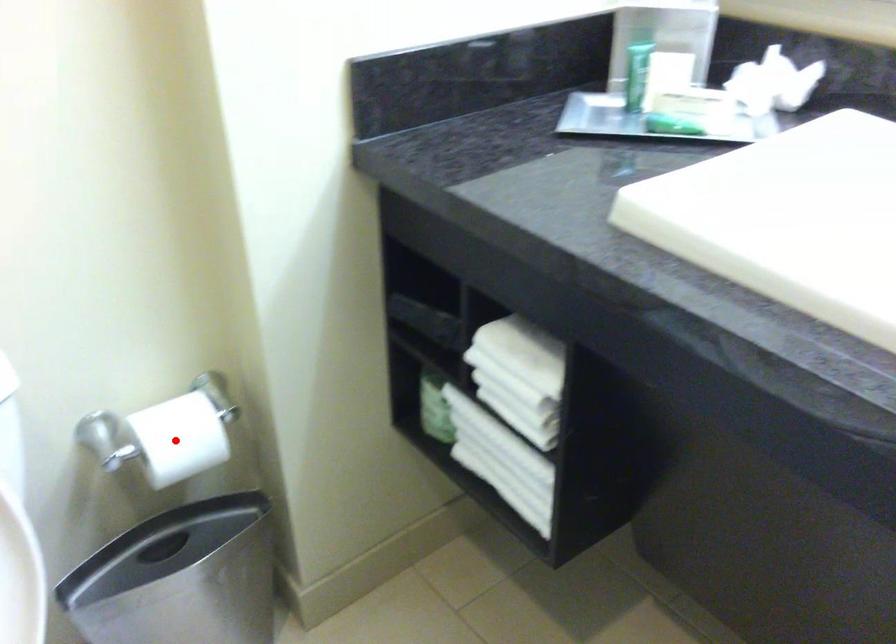
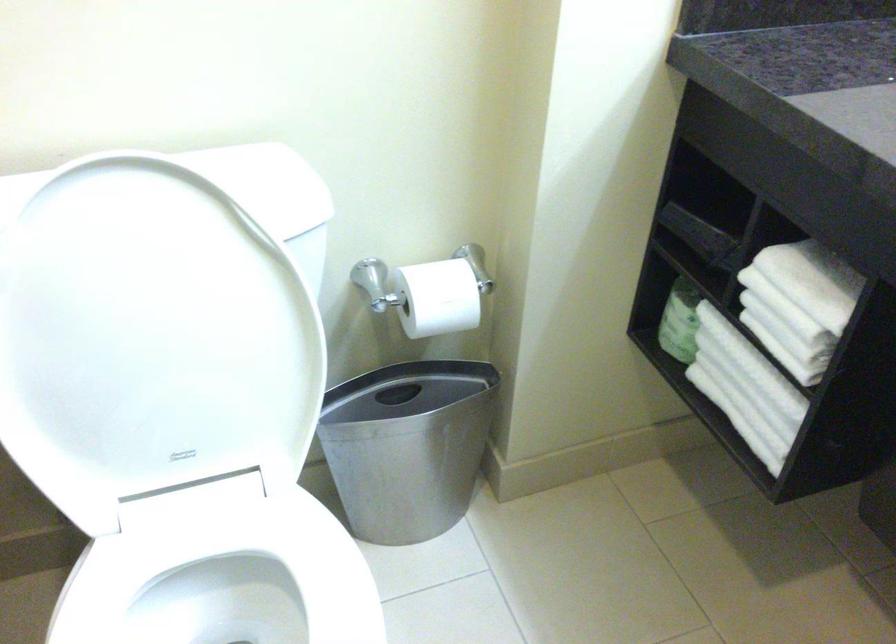
Locate, in the second image, the point that corresponds to the highlighted location in the first image.

(436, 298)